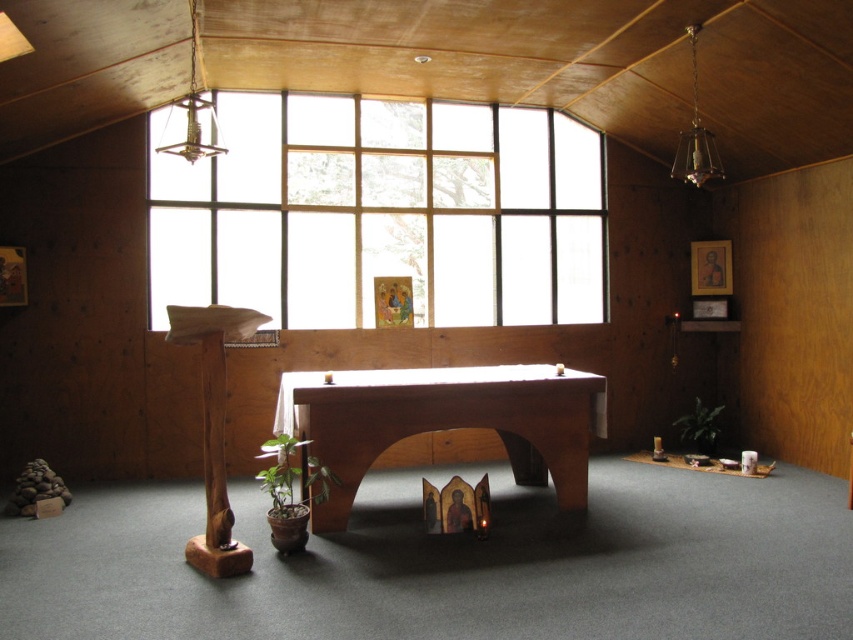
You are standing in the chapel and want to move from the altar table to the open book on the floor. The altar table is located at point (x=219, y=264), and the open book is at point (x=575, y=422). Which direction should you move to reach the book?

To reach the open book on the floor at point (x=575, y=422) from the altar table at point (x=219, y=264), you should move away from the viewer since point (x=575, y=422) is further away than point (x=219, y=264).